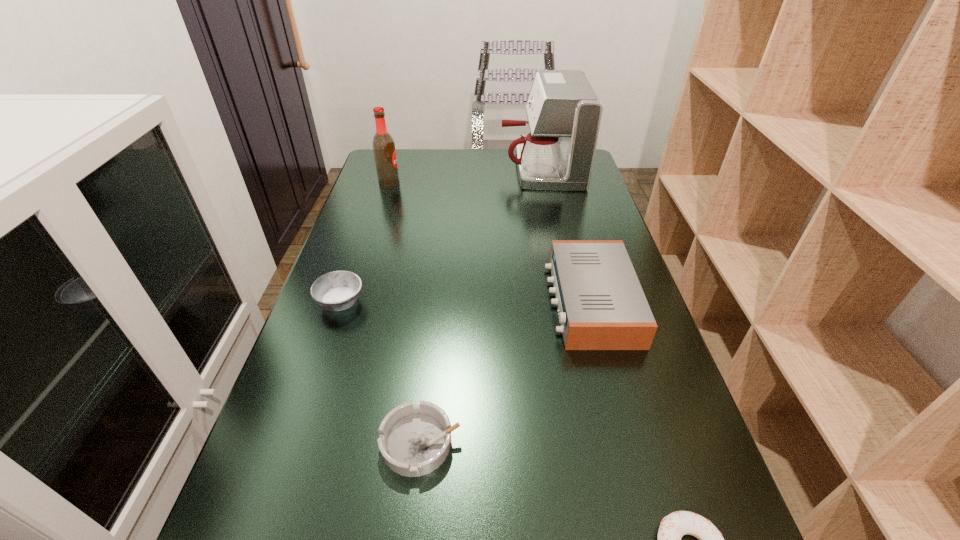
The width and height of the screenshot is (960, 540). Find the location of `the second closest object to the third shortest object`. the second closest object to the third shortest object is located at coordinates (601, 304).

I want to click on object that is the fourth closest to the nearest object, so click(564, 114).

The height and width of the screenshot is (540, 960). I want to click on vacant region that satisfies the following two spatial constraints: 1. on the front of the coffee maker near the spout; 2. on the front side of the second tallest object, so click(544, 184).

This screenshot has height=540, width=960. What are the coordinates of `vacant space that satisfies the following two spatial constraints: 1. on the front of the coffee maker near the spout; 2. on the front side of the taller ashtray` in the screenshot? It's located at (570, 302).